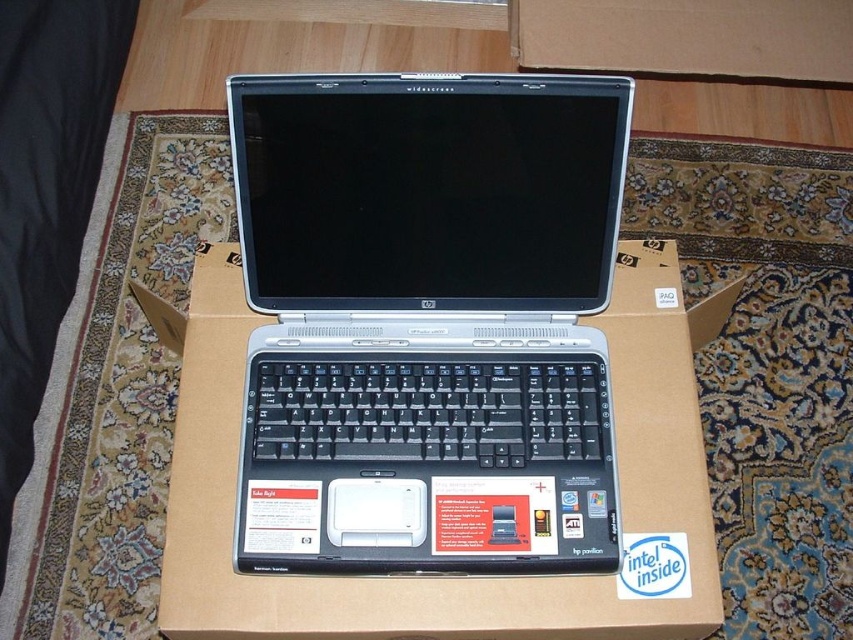
Question: Which point is farther from the camera taking this photo?

Choices:
 (A) (425, 380)
 (B) (463, 456)
 (C) (175, 499)

Answer: (A)

Question: Is silver/black keyboard at center to the left of black plastic keyboard at center from the viewer's perspective?

Choices:
 (A) no
 (B) yes

Answer: (B)

Question: Which is farther from the black plastic keyboard at center?

Choices:
 (A) cardboard at center
 (B) silver/black keyboard at center

Answer: (A)

Question: Is cardboard at center wider than black plastic keyboard at center?

Choices:
 (A) no
 (B) yes

Answer: (B)

Question: Can you confirm if silver/black keyboard at center is bigger than black plastic keyboard at center?

Choices:
 (A) yes
 (B) no

Answer: (A)

Question: Which object is positioned farthest from the black plastic keyboard at center?

Choices:
 (A) silver/black keyboard at center
 (B) cardboard at center

Answer: (B)